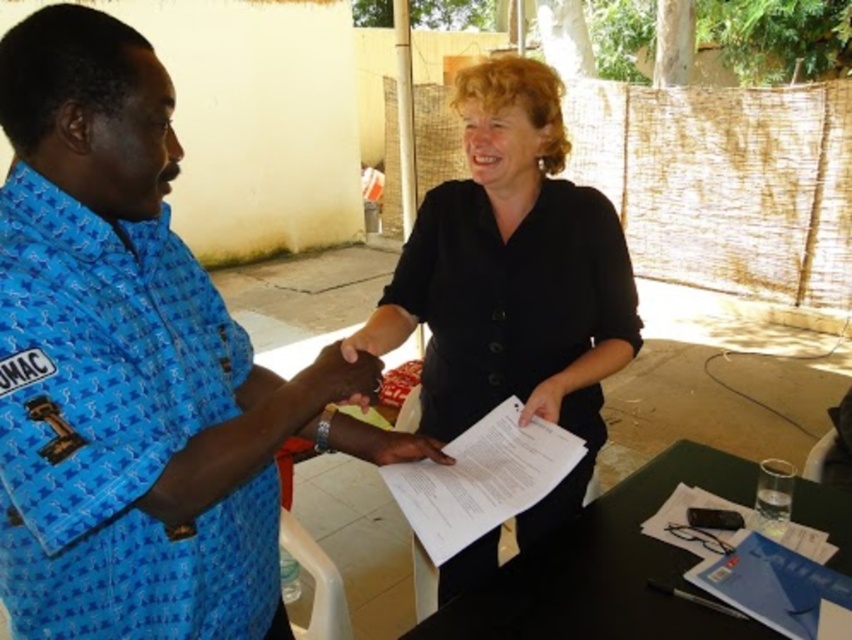
Question: Does dark skin hand at center have a larger size compared to matte paper at center?

Choices:
 (A) yes
 (B) no

Answer: (A)

Question: Considering the relative positions of black plastic table at lower right and white paper at center in the image provided, where is black plastic table at lower right located with respect to white paper at center?

Choices:
 (A) below
 (B) above

Answer: (A)

Question: Does blue printed shirt at center have a larger size compared to white paper at lower right?

Choices:
 (A) no
 (B) yes

Answer: (B)

Question: Which object is the farthest from the white paper at center?

Choices:
 (A) black plastic table at lower right
 (B) black matte shirt at center

Answer: (B)

Question: Which point is farther from the camera taking this photo?

Choices:
 (A) (142, 488)
 (B) (528, 467)
 (C) (622, 237)

Answer: (C)

Question: Which of the following is the farthest from the observer?

Choices:
 (A) (413, 440)
 (B) (826, 529)

Answer: (B)